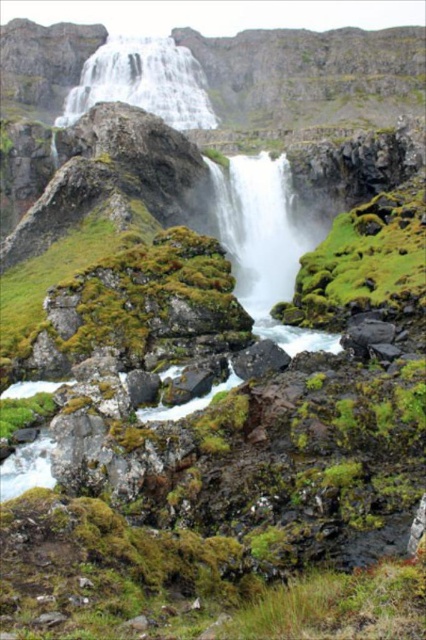
Question: Can you confirm if white smooth waterfall at center is smaller than white frothy water at upper center?

Choices:
 (A) yes
 (B) no

Answer: (A)

Question: Which point is closer to the camera?

Choices:
 (A) (247, 205)
 (B) (371, 218)

Answer: (B)

Question: Which point is closer to the camera?

Choices:
 (A) white frothy water at upper center
 (B) green mossy rock at center
 (C) white smooth waterfall at center

Answer: (B)

Question: Is green mossy rock at center bigger than white smooth waterfall at center?

Choices:
 (A) no
 (B) yes

Answer: (A)

Question: Does green mossy rock at center have a lesser width compared to white smooth waterfall at center?

Choices:
 (A) no
 (B) yes

Answer: (A)

Question: Which object is farther from the camera taking this photo?

Choices:
 (A) white frothy water at upper center
 (B) green mossy rock at center

Answer: (A)